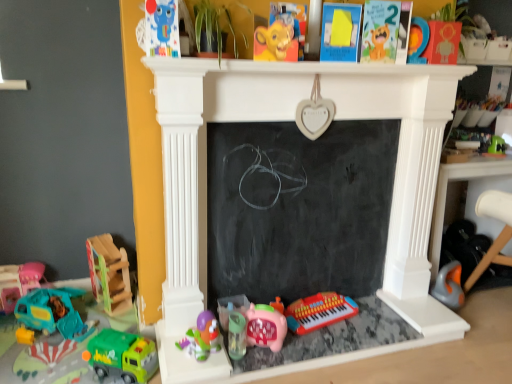
Question: From a real-world perspective, relative to matte orange wooden number at upper right, the 2th toy viewed from the right, is pink matte piggy bank at center, which is the fifth toy in right-to-left order, vertically above or below?

Choices:
 (A) below
 (B) above

Answer: (A)

Question: From the image's perspective, is pink matte piggy bank at center, which is the fifth toy in right-to-left order, positioned above or below matte orange wooden number at upper right, marked as the eleventh toy in a left-to-right arrangement?

Choices:
 (A) below
 (B) above

Answer: (A)

Question: Which of these objects is positioned farthest from the pink matte piggy bank at center, the eighth toy in the left-to-right sequence?

Choices:
 (A) teal plastic toy car at lower left, placed as the 11th toy when sorted from right to left
 (B) orange plastic vacuum cleaner at lower right, the twelfth toy when ordered from left to right
 (C) wooden rocking horse at left, the tenth toy in the right-to-left sequence
 (D) plastic red keyboard at lower center, which ranks as the 4th toy in right-to-left order
 (E) teal plastic toy car at left, placed as the 1th toy when sorted from left to right

Answer: (E)

Question: Which of these objects is positioned farthest from the plastic red keyboard at lower center, the ninth toy positioned from the left?

Choices:
 (A) teal plastic toy car at lower left, placed as the 11th toy when sorted from right to left
 (B) black chalkboard at center
 (C) yellow matte lion head at upper center
 (D) matte orange wooden number at upper right, marked as the eleventh toy in a left-to-right arrangement
 (E) teal plastic toy car at left, arranged as the 12th toy when viewed from the right

Answer: (E)